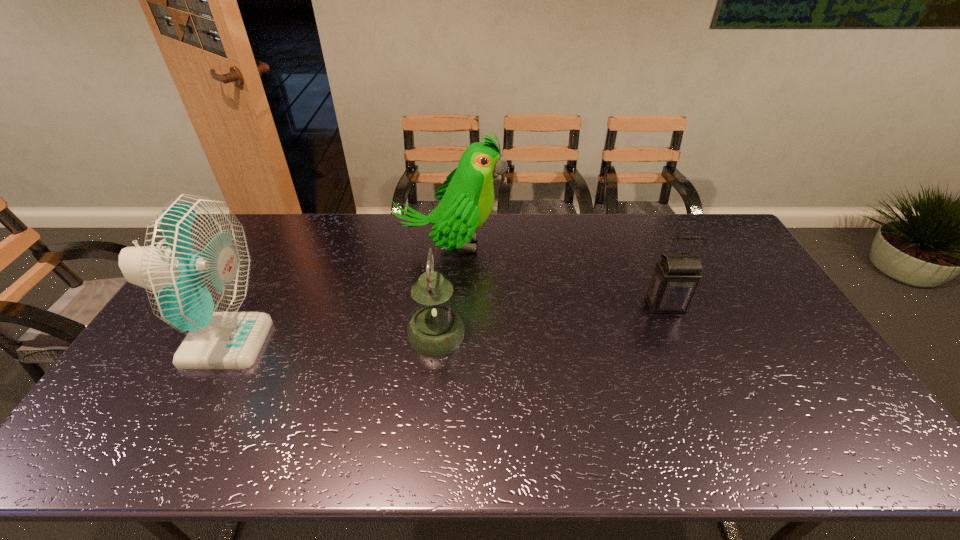
Choose which object is the third nearest neighbor to the leftmost object. Please provide its 2D coordinates. Your answer should be formatted as a tuple, i.e. [(x, y)], where the tuple contains the x and y coordinates of a point satisfying the conditions above.

[(676, 276)]

Find the location of a particular element. vacant space that satisfies the following two spatial constraints: 1. on the front side of the left lantern; 2. in front of the leftmost object to face the airflow is located at coordinates [x=436, y=342].

You are a GUI agent. You are given a task and a screenshot of the screen. Output one action in this format:
    pyautogui.click(x=<x>, y=<y>)
    Task: Click on the free space in the image that satisfies the following two spatial constraints: 1. on the front-facing side of the rightmost object; 2. in front of the leftmost object to face the airflow
    The width and height of the screenshot is (960, 540).
    Given the screenshot: What is the action you would take?
    point(682,342)

At what (x,y) coordinates should I click in order to perform the action: click on vacant area that satisfies the following two spatial constraints: 1. on the front-facing side of the right lantern; 2. in front of the leftmost object to face the airflow. Please return your answer as a coordinate pair (x, y). This screenshot has width=960, height=540. Looking at the image, I should click on (682, 342).